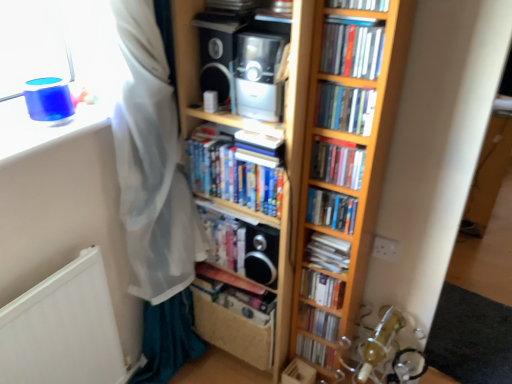
Question: Considering the relative positions of hardcover books at center, which is the eighth book from bottom to top, and hardcover book at center, the second book positioned from the bottom, in the image provided, is hardcover books at center, which is the eighth book from bottom to top, to the right of hardcover book at center, the second book positioned from the bottom, from the viewer's perspective?

Choices:
 (A) no
 (B) yes

Answer: (A)

Question: Is hardcover books at center, arranged as the 5th book when viewed from the top, facing away from hardcover book at center, which is the 11th book in top-to-bottom order?

Choices:
 (A) yes
 (B) no

Answer: (B)

Question: Can you confirm if hardcover books at center, arranged as the 5th book when viewed from the top, is wider than hardcover book at center, the second book positioned from the bottom?

Choices:
 (A) no
 (B) yes

Answer: (B)

Question: Is hardcover books at center, which is the eighth book from bottom to top, oriented towards hardcover book at center, the second book positioned from the bottom?

Choices:
 (A) no
 (B) yes

Answer: (A)

Question: Can you confirm if hardcover books at center, which is the eighth book from bottom to top, is thinner than hardcover book at center, which is the 11th book in top-to-bottom order?

Choices:
 (A) yes
 (B) no

Answer: (B)

Question: Is hardcover books at center, which is the eighth book from bottom to top, positioned behind hardcover book at center, the second book positioned from the bottom?

Choices:
 (A) no
 (B) yes

Answer: (A)

Question: Does satin black speaker at center, which appears as the 1th speaker when ordered from the bottom, have a greater height compared to hardcover book at center, which appears as the 3th book when ordered from the bottom?

Choices:
 (A) no
 (B) yes

Answer: (B)

Question: Could hardcover book at center, which appears as the 3th book when ordered from the bottom, be considered to be inside satin black speaker at center, which is the first speaker in right-to-left order?

Choices:
 (A) no
 (B) yes

Answer: (A)

Question: Is satin black speaker at center, which is the second speaker from left to right, far from hardcover book at center, arranged as the 10th book when viewed from the top?

Choices:
 (A) no
 (B) yes

Answer: (A)

Question: Does satin black speaker at center, which is the second speaker from left to right, appear on the left side of hardcover book at center, arranged as the 10th book when viewed from the top?

Choices:
 (A) yes
 (B) no

Answer: (B)

Question: Does satin black speaker at center, which is the second speaker from left to right, have a lesser height compared to hardcover book at center, which appears as the 3th book when ordered from the bottom?

Choices:
 (A) no
 (B) yes

Answer: (A)

Question: Is satin black speaker at center, which is the first speaker in right-to-left order, smaller than hardcover book at center, which appears as the 3th book when ordered from the bottom?

Choices:
 (A) yes
 (B) no

Answer: (A)

Question: Is hardcover book at center, acting as the 9th book starting from the top, facing towards matte black speaker at upper center, the 1th speaker when ordered from top to bottom?

Choices:
 (A) yes
 (B) no

Answer: (B)